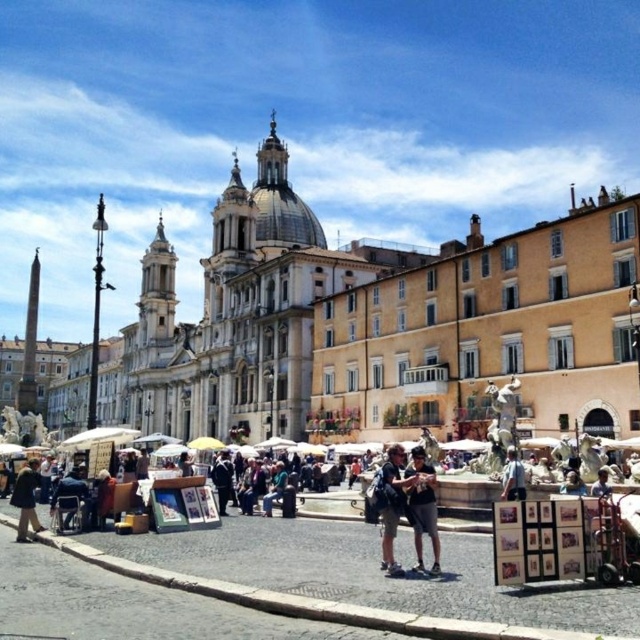
You are standing at the edge of Piazza Navona and see both the dark blue jeans at center and the denim shorts at center. If you want to reach both items, which one do you need to walk towards first?

You need to walk towards the dark blue jeans at center first since it is closer to you at 4.55 feet away compared to the denim shorts at center which are farther away.

In the Piazza Navona scene, you see a person wearing dark blue jeans at center and another wearing a brown fur coat at lower left. From the perspective of someone standing at the center of the square facing the church, which clothing item is positioned to the right?

The dark blue jeans at center is to the right of the brown fur coat at lower left from the observer standing at the center facing the church.